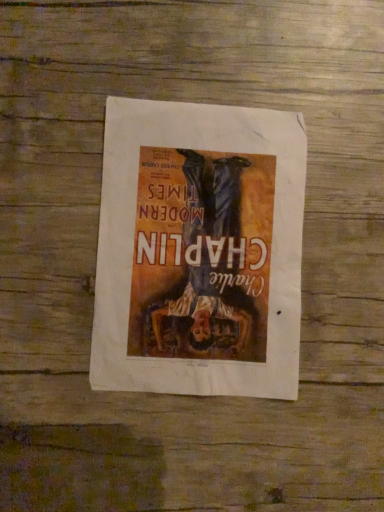
Image resolution: width=384 pixels, height=512 pixels. What do you see at coordinates (199, 250) in the screenshot? I see `matte paper poster at center` at bounding box center [199, 250].

This screenshot has width=384, height=512. I want to click on matte paper poster at center, so click(x=199, y=250).

I want to click on matte paper poster at center, so click(199, 250).